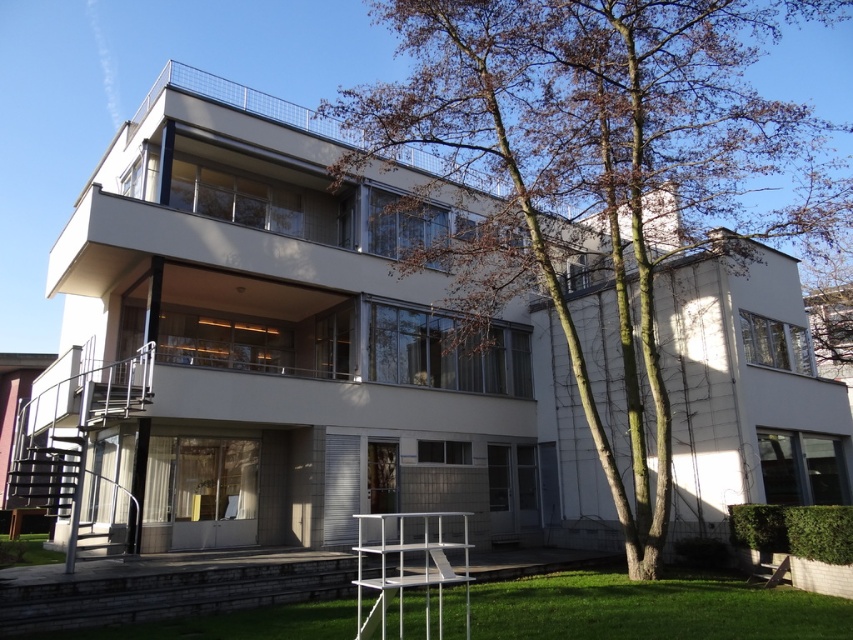
Question: Which object appears closest to the camera in this image?

Choices:
 (A) white metal chair at lower center
 (B) brown leafy tree at center
 (C) green grass at lower center

Answer: (A)

Question: Estimate the real-world distances between objects in this image. Which object is farther from the green grass at lower left?

Choices:
 (A) white metal chair at lower center
 (B) brown leafy tree at center

Answer: (B)

Question: Which of the following is the closest to the observer?

Choices:
 (A) brown leafy tree at center
 (B) white metal chair at lower center
 (C) green grass at lower left
 (D) green grass at lower center

Answer: (B)

Question: Does brown leafy tree at center lie in front of green grass at lower left?

Choices:
 (A) no
 (B) yes

Answer: (B)

Question: Is brown leafy tree at center thinner than green grass at lower center?

Choices:
 (A) no
 (B) yes

Answer: (A)

Question: Does white metal chair at lower center appear on the left side of green grass at lower left?

Choices:
 (A) no
 (B) yes

Answer: (A)